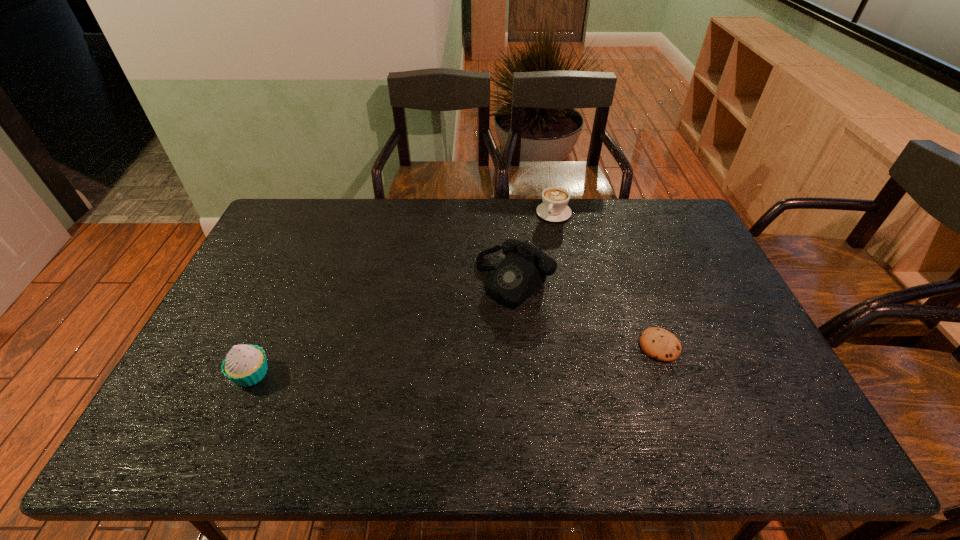
You are a GUI agent. You are given a task and a screenshot of the screen. Output one action in this format:
    pyautogui.click(x=<x>, y=<y>)
    Task: Click on the object that is the second closest one to the cupcake
    The height and width of the screenshot is (540, 960).
    Given the screenshot: What is the action you would take?
    pyautogui.click(x=554, y=208)

This screenshot has height=540, width=960. What are the coordinates of `object that is the third closest one to the cookie` in the screenshot? It's located at (245, 365).

Where is `free spot that satisfies the following two spatial constraints: 1. on the back side of the rightmost object; 2. on the left side of the leftmost object`? This screenshot has height=540, width=960. free spot that satisfies the following two spatial constraints: 1. on the back side of the rightmost object; 2. on the left side of the leftmost object is located at coordinates (263, 346).

Where is `vacant area in the image that satisfies the following two spatial constraints: 1. on the back side of the cupcake; 2. on the left side of the cookie`? The height and width of the screenshot is (540, 960). vacant area in the image that satisfies the following two spatial constraints: 1. on the back side of the cupcake; 2. on the left side of the cookie is located at coordinates (263, 346).

I want to click on free space that satisfies the following two spatial constraints: 1. on the back side of the rightmost object; 2. on the right side of the cupcake, so click(263, 346).

Where is `free space that satisfies the following two spatial constraints: 1. on the front side of the shortest object; 2. on the right side of the farthest object`? free space that satisfies the following two spatial constraints: 1. on the front side of the shortest object; 2. on the right side of the farthest object is located at coordinates (581, 346).